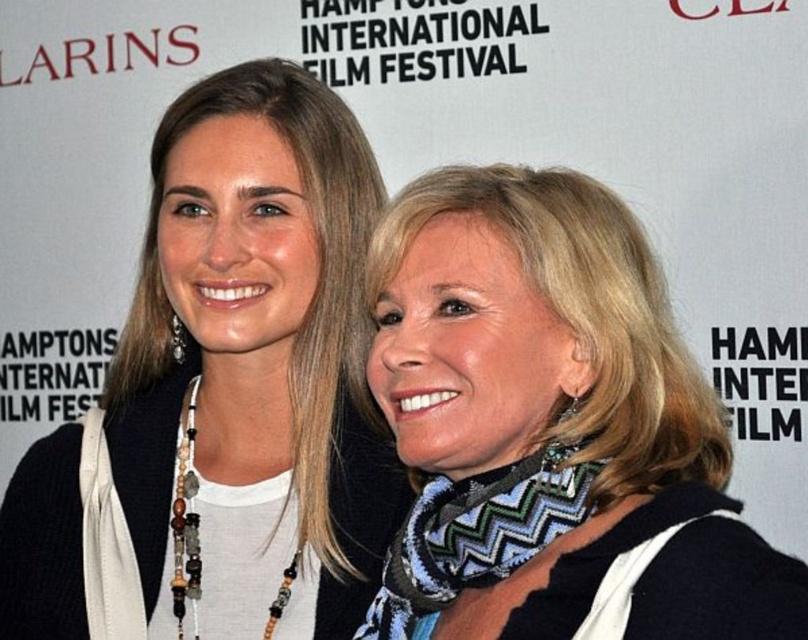
Between matte black scarf at upper center and blue zigzag scarf at center, which one has more height?

matte black scarf at upper center

Between point (291, 224) and point (590, 467), which one is positioned behind?

The point (291, 224) is behind.

Where is `matte black scarf at upper center`? The width and height of the screenshot is (808, 640). matte black scarf at upper center is located at coordinates (222, 396).